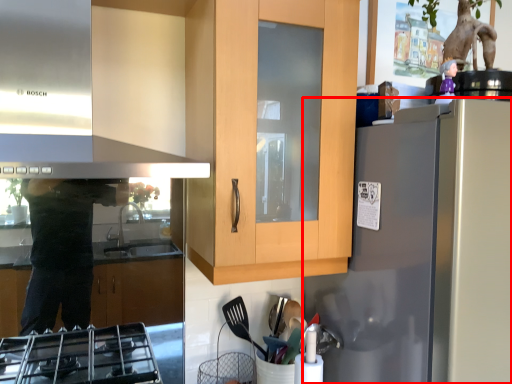
Question: Considering the relative positions of refrigerator (annotated by the red box) and exhaust hood in the image provided, where is refrigerator (annotated by the red box) located with respect to the staircase?

Choices:
 (A) left
 (B) right

Answer: (B)